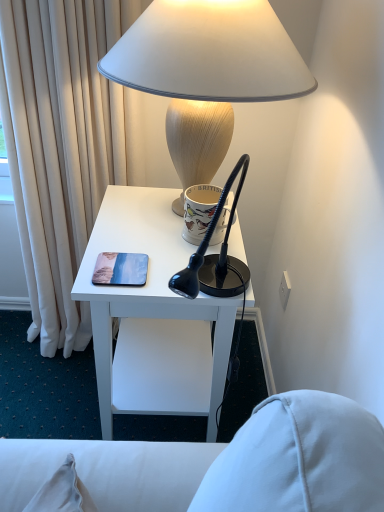
What is the approximate width of white glossy desk at center?

40.48 centimeters.

What do you see at coordinates (209, 53) in the screenshot? I see `white matte lampshade at upper center` at bounding box center [209, 53].

Identify the location of white glossy desk at center. This screenshot has height=512, width=384. (147, 284).

Considering the sizes of objects white ceramic mug at upper center and white matte lampshade at upper center in the image provided, who is smaller, white ceramic mug at upper center or white matte lampshade at upper center?

Smaller between the two is white ceramic mug at upper center.

How different are the orientations of white ceramic mug at upper center and white matte lampshade at upper center in degrees?

The angular difference between white ceramic mug at upper center and white matte lampshade at upper center is 2.77 degrees.

Is white ceramic mug at upper center positioned with its back to white matte lampshade at upper center?

That's right, white ceramic mug at upper center is facing away from white matte lampshade at upper center.

Is white ceramic mug at upper center next to white matte lampshade at upper center and touching it?

white ceramic mug at upper center and white matte lampshade at upper center are not in contact.

In terms of height, does white matte lampshade at upper center look taller or shorter compared to white ceramic mug at upper center?

Considering their sizes, white matte lampshade at upper center has more height than white ceramic mug at upper center.

Can you see white matte lampshade at upper center touching white ceramic mug at upper center?

No, white matte lampshade at upper center is not next to white ceramic mug at upper center.

Could you tell me if white matte lampshade at upper center is turned towards white ceramic mug at upper center?

No, white matte lampshade at upper center is not turned towards white ceramic mug at upper center.

Considering the positions of objects white matte lampshade at upper center and white ceramic mug at upper center in the image provided, who is more to the right, white matte lampshade at upper center or white ceramic mug at upper center?

From the viewer's perspective, white ceramic mug at upper center appears more on the right side.

Is point (233, 98) closer or farther from the camera than point (252, 306)?

Point (233, 98) is positioned closer to the camera compared to point (252, 306).

From a real-world perspective, is white matte lampshade at upper center above or below white glossy desk at center?

From a real-world perspective, white matte lampshade at upper center is physically above white glossy desk at center.

Find the location of `lamp in front of the white glossy desk at center`. lamp in front of the white glossy desk at center is located at coordinates (209, 53).

Is white glossy desk at center behind white matte lampshade at upper center?

Yes, white glossy desk at center is further from the camera.

Considering the positions of objects white glossy desk at center and white matte lampshade at upper center in the image provided, who is more to the right, white glossy desk at center or white matte lampshade at upper center?

From the viewer's perspective, white matte lampshade at upper center appears more on the right side.

Can you tell me how much white glossy desk at center and white matte lampshade at upper center differ in facing direction?

They differ by 2.51 degrees in their facing directions.

Where is `desk below the white matte lampshade at upper center (from the image's perspective)`? The height and width of the screenshot is (512, 384). desk below the white matte lampshade at upper center (from the image's perspective) is located at coordinates (147, 284).

Does white ceramic mug at upper center turn towards white glossy desk at center?

No, white ceramic mug at upper center does not turn towards white glossy desk at center.

From the image's perspective, between white ceramic mug at upper center and white glossy desk at center, who is located below?

From the image's view, white glossy desk at center is below.

Does white ceramic mug at upper center have a lesser width compared to white glossy desk at center?

Correct, the width of white ceramic mug at upper center is less than that of white glossy desk at center.

Is white ceramic mug at upper center far from white glossy desk at center?

No, white ceramic mug at upper center is not far away from white glossy desk at center.

Considering the points (140, 200) and (186, 234), which point is behind, point (140, 200) or point (186, 234)?

Positioned behind is point (140, 200).

Is white glossy desk at center inside the boundaries of white ceramic mug at upper center, or outside?

white glossy desk at center is outside white ceramic mug at upper center.

How different are the orientations of white glossy desk at center and white ceramic mug at upper center in degrees?

The facing directions of white glossy desk at center and white ceramic mug at upper center are 0.26 degrees apart.

From a real-world perspective, is white glossy desk at center under white ceramic mug at upper center?

Yes, from a real-world perspective, white glossy desk at center is beneath white ceramic mug at upper center.

Identify the location of lamp in front of the white ceramic mug at upper center. (209, 53).

Image resolution: width=384 pixels, height=512 pixels. Find the location of `lamp that is above the white ceramic mug at upper center (from the image's perspective)`. lamp that is above the white ceramic mug at upper center (from the image's perspective) is located at coordinates (209, 53).

When comparing their distances from white ceramic mug at upper center, does white matte lampshade at upper center or white glossy desk at center seem further?

white matte lampshade at upper center is further to white ceramic mug at upper center.

Which object lies further to the anchor point white matte lampshade at upper center, white ceramic mug at upper center or white glossy desk at center?

white glossy desk at center.

Consider the image. Based on their spatial positions, is white matte lampshade at upper center or white ceramic mug at upper center closer to white glossy desk at center?

Based on the image, white ceramic mug at upper center appears to be nearer to white glossy desk at center.

Considering their positions, is white glossy desk at center positioned further to white ceramic mug at upper center than white matte lampshade at upper center?

Among the two, white matte lampshade at upper center is located further to white ceramic mug at upper center.

Estimate the real-world distances between objects in this image. Which object is further from white glossy desk at center, white ceramic mug at upper center or white matte lampshade at upper center?

Based on the image, white matte lampshade at upper center appears to be further to white glossy desk at center.

From the image, which object appears to be nearer to white matte lampshade at upper center, white glossy desk at center or white ceramic mug at upper center?

Among the two, white ceramic mug at upper center is located nearer to white matte lampshade at upper center.

Where is `coffee cup that lies between white matte lampshade at upper center and white glossy desk at center from top to bottom`? The width and height of the screenshot is (384, 512). coffee cup that lies between white matte lampshade at upper center and white glossy desk at center from top to bottom is located at coordinates (199, 211).